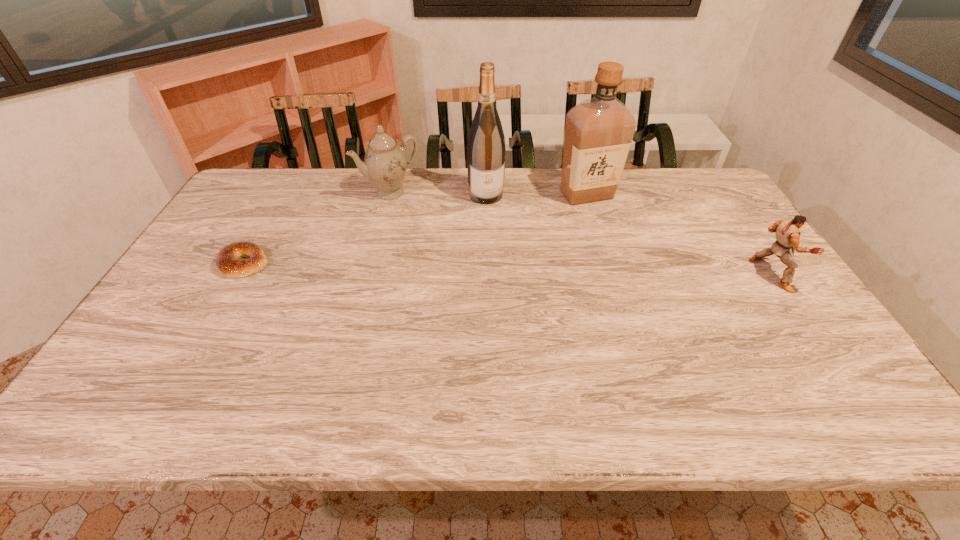
Where is `bagel`? The width and height of the screenshot is (960, 540). bagel is located at coordinates (228, 261).

At what (x,y) coordinates should I click in order to perform the action: click on the shortest object. Please return your answer as a coordinate pair (x, y). This screenshot has width=960, height=540. Looking at the image, I should click on (228, 261).

I want to click on the rightmost object, so click(x=787, y=231).

Find the location of a particular element. Image resolution: width=960 pixels, height=540 pixels. the fourth tallest object is located at coordinates (787, 231).

The width and height of the screenshot is (960, 540). Find the location of `the fourth object from right to left`. the fourth object from right to left is located at coordinates (385, 163).

The height and width of the screenshot is (540, 960). Identify the location of the third tallest object. (385, 163).

Find the location of `liquor`. liquor is located at coordinates (599, 131).

Where is `wine bottle`? This screenshot has height=540, width=960. wine bottle is located at coordinates (486, 150).

Where is `vacant space located 0.200m on the back of the bagel`? This screenshot has width=960, height=540. vacant space located 0.200m on the back of the bagel is located at coordinates (276, 208).

This screenshot has height=540, width=960. In order to click on blank space located 0.220m on the spout of the third tallest object in this screenshot , I will do `click(431, 240)`.